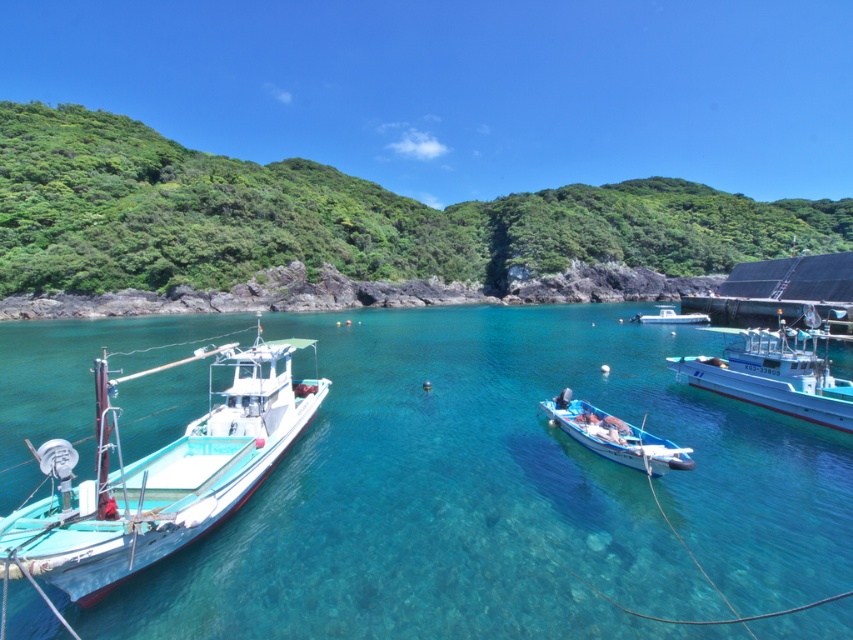
From the picture: Between clear blue water at center and white glossy boat at center, which one has less height?

With less height is white glossy boat at center.

Is clear blue water at center bigger than white glossy boat at center?

Indeed, clear blue water at center has a larger size compared to white glossy boat at center.

Where is `clear blue water at center`? The image size is (853, 640). clear blue water at center is located at coordinates (503, 493).

Is clear blue water at center wider than white wooden boat at center?

Yes.

Who is positioned more to the left, clear blue water at center or white wooden boat at center?

clear blue water at center is more to the left.

Locate an element on the screen. clear blue water at center is located at coordinates 503,493.

This screenshot has width=853, height=640. What are the coordinates of `clear blue water at center` in the screenshot? It's located at (503, 493).

Can you confirm if teal matte boat at left is thinner than white glossy boat at center?

Correct, teal matte boat at left's width is less than white glossy boat at center's.

Is teal matte boat at left positioned in front of white glossy boat at center?

Yes, teal matte boat at left is in front of white glossy boat at center.

Is point (247, 353) positioned in front of point (679, 321)?

Yes.

Where is `teal matte boat at left`? Image resolution: width=853 pixels, height=640 pixels. teal matte boat at left is located at coordinates (160, 474).